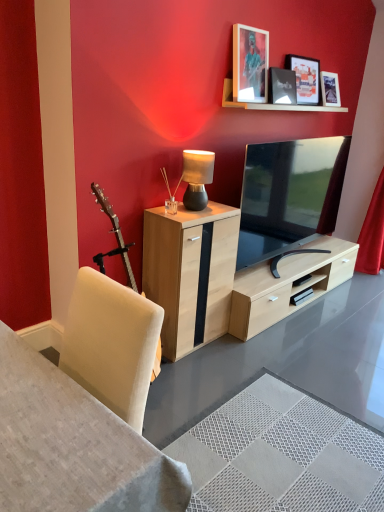
The height and width of the screenshot is (512, 384). What do you see at coordinates (73, 445) in the screenshot? I see `white fabric desk at lower left` at bounding box center [73, 445].

Describe the element at coordinates (305, 78) in the screenshot. The height and width of the screenshot is (512, 384). I see `matte black picture frame at upper center, the third picture frame viewed from the left` at that location.

The width and height of the screenshot is (384, 512). I want to click on matte black tv at center, so click(289, 195).

This screenshot has width=384, height=512. Describe the element at coordinates (289, 195) in the screenshot. I see `matte black tv at center` at that location.

Identify the location of wooden shelf at upper center. Image resolution: width=384 pixels, height=512 pixels. (272, 104).

Based on their positions, is light wood cabinet at center located to the left or right of matte black picture frame at upper center, the third picture frame viewed from the left?

light wood cabinet at center is positioned on matte black picture frame at upper center, the third picture frame viewed from the left,'s left side.

From the image's perspective, between light wood cabinet at center and matte black picture frame at upper center, which is the 1th picture frame from right to left, which one is located above?

matte black picture frame at upper center, which is the 1th picture frame from right to left, appears higher in the image.

Consider the image. Can you tell me how much light wood cabinet at center and matte black picture frame at upper center, which is the 1th picture frame from right to left, differ in facing direction?

The angular difference between light wood cabinet at center and matte black picture frame at upper center, which is the 1th picture frame from right to left, is 1.88 degrees.

Is light wood cabinet at center shorter than matte black picture frame at upper center, which is the 1th picture frame from right to left?

In fact, light wood cabinet at center may be taller than matte black picture frame at upper center, which is the 1th picture frame from right to left.

Which is more to the right, red velvet curtain at right or matte black tv at center?

red velvet curtain at right.

Based on the photo, which is farther, (x=363, y=256) or (x=335, y=152)?

Point (x=363, y=256)

Who is shorter, red velvet curtain at right or matte black tv at center?

Standing shorter between the two is matte black tv at center.

Locate an element on the screen. The height and width of the screenshot is (512, 384). curtain lying on the right of matte black tv at center is located at coordinates (372, 233).

Could you measure the distance between matte black picture frame at upper center, the third picture frame viewed from the left, and matte wooden picture frame at upper center, the 3th picture frame positioned from the right?

The distance of matte black picture frame at upper center, the third picture frame viewed from the left, from matte wooden picture frame at upper center, the 3th picture frame positioned from the right, is 16.55 inches.

There is a matte black picture frame at upper center, which is the 1th picture frame from right to left. Where is `the 1st picture frame below it (from the image's perspective)`? The width and height of the screenshot is (384, 512). the 1st picture frame below it (from the image's perspective) is located at coordinates (250, 64).

Between point (299, 69) and point (259, 46), which one is positioned behind?

Point (299, 69)

Is matte black picture frame at upper center, which is the 1th picture frame from right to left, not inside matte wooden picture frame at upper center, the 3th picture frame positioned from the right?

Indeed, matte black picture frame at upper center, which is the 1th picture frame from right to left, is completely outside matte wooden picture frame at upper center, the 3th picture frame positioned from the right.

Is matte black table lamp at center looking in the opposite direction of red velvet curtain at right?

That's not correct — matte black table lamp at center is not looking away from red velvet curtain at right.

Which object is wider, matte black table lamp at center or red velvet curtain at right?

Wider between the two is red velvet curtain at right.

Is matte black table lamp at center at the left side of red velvet curtain at right?

Yes.

Identify the location of curtain below the matte black table lamp at center (from a real-world perspective). This screenshot has width=384, height=512. (372, 233).

Is matte black tv at center outside of white fabric desk at lower left?

Yes.

Is the depth of matte black tv at center greater than that of white fabric desk at lower left?

Yes.

From a real-world perspective, which is physically below, matte black tv at center or white fabric desk at lower left?

white fabric desk at lower left, from a real-world perspective.

Considering the relative positions of matte black tv at center and white fabric desk at lower left in the image provided, is matte black tv at center to the left or to the right of white fabric desk at lower left?

Based on their positions, matte black tv at center is located to the right of white fabric desk at lower left.

Does matte black picture frame at upper center, which is the 1th picture frame from right to left, appear on the left side of light wood cabinet at center?

Incorrect, matte black picture frame at upper center, which is the 1th picture frame from right to left, is not on the left side of light wood cabinet at center.

How far apart are matte black picture frame at upper center, which is the 1th picture frame from right to left, and light wood cabinet at center?

matte black picture frame at upper center, which is the 1th picture frame from right to left, is 4.88 feet from light wood cabinet at center.

From a real-world perspective, who is located higher, matte black picture frame at upper center, which is the 1th picture frame from right to left, or light wood cabinet at center?

matte black picture frame at upper center, which is the 1th picture frame from right to left, is physically above.

Is matte black picture frame at upper center, which is the 1th picture frame from right to left, in front of or behind light wood cabinet at center in the image?

matte black picture frame at upper center, which is the 1th picture frame from right to left, is behind light wood cabinet at center.

Based on their positions, is matte wooden picture frame at upper center, the 3th picture frame positioned from the right, located to the left or right of matte black tv at center?

matte wooden picture frame at upper center, the 3th picture frame positioned from the right, is positioned on matte black tv at center's left side.

How different are the orientations of matte wooden picture frame at upper center, the 3th picture frame positioned from the right, and matte black tv at center in degrees?

They differ by 0.369 degrees in their facing directions.

Relative to matte black tv at center, is matte wooden picture frame at upper center, placed as the 1th picture frame when sorted from left to right, in front or behind?

matte wooden picture frame at upper center, placed as the 1th picture frame when sorted from left to right, is positioned farther from the viewer than matte black tv at center.

How much distance is there between matte wooden picture frame at upper center, placed as the 1th picture frame when sorted from left to right, and matte black tv at center?

matte wooden picture frame at upper center, placed as the 1th picture frame when sorted from left to right, and matte black tv at center are 25.49 inches apart.

In the image, there is a matte black picture frame at upper center, the third picture frame viewed from the left. Where is `cabinetry below it (from a real-world perspective)`? This screenshot has height=512, width=384. cabinetry below it (from a real-world perspective) is located at coordinates (190, 272).

The image size is (384, 512). Identify the location of curtain behind the matte black tv at center. (372, 233).

Considering their positions, is red velvet curtain at right positioned further to white fabric desk at lower left than wooden shelf at upper center?

Based on the image, red velvet curtain at right appears to be further to white fabric desk at lower left.

Based on their spatial positions, is matte black picture frame at upper center, the second picture frame when ordered from right to left, or white fabric desk at lower left closer to matte black picture frame at upper center, the third picture frame viewed from the left?

matte black picture frame at upper center, the second picture frame when ordered from right to left, is closer to matte black picture frame at upper center, the third picture frame viewed from the left.

When comparing their distances from light wood cabinet at center, does matte black picture frame at upper center, the second picture frame when ordered from right to left, or wooden shelf at upper center seem further?

Among the two, matte black picture frame at upper center, the second picture frame when ordered from right to left, is located further to light wood cabinet at center.

Looking at the image, which one is located further to matte black table lamp at center, white fabric desk at lower left or matte wooden picture frame at upper center, placed as the 1th picture frame when sorted from left to right?

Based on the image, white fabric desk at lower left appears to be further to matte black table lamp at center.

When comparing their distances from matte black table lamp at center, does matte wooden picture frame at upper center, placed as the 1th picture frame when sorted from left to right, or red velvet curtain at right seem closer?

matte wooden picture frame at upper center, placed as the 1th picture frame when sorted from left to right.

Looking at the image, which one is located further to matte black picture frame at upper center, the second picture frame when ordered from right to left, matte black tv at center or white fabric desk at lower left?

white fabric desk at lower left is positioned further to the anchor matte black picture frame at upper center, the second picture frame when ordered from right to left.

Which object lies further to the anchor point light wood cabinet at center, matte black table lamp at center or matte black tv at center?

Based on the image, matte black tv at center appears to be further to light wood cabinet at center.

Considering their positions, is light wood cabinet at center positioned closer to matte black table lamp at center than matte black picture frame at upper center, the second picture frame when ordered from right to left?

Based on the image, light wood cabinet at center appears to be nearer to matte black table lamp at center.

At what (x,y) coordinates should I click in order to perform the action: click on picture frame between wooden shelf at upper center and red velvet curtain at right from left to right. Please return your answer as a coordinate pair (x, y). This screenshot has width=384, height=512. Looking at the image, I should click on (305, 78).

Image resolution: width=384 pixels, height=512 pixels. Identify the location of shelf between white fabric desk at lower left and matte black picture frame at upper center, which is the 1th picture frame from right to left, in the front-back direction. (272, 104).

In order to click on television situated between light wood cabinet at center and red velvet curtain at right from left to right in this screenshot , I will do `click(289, 195)`.

This screenshot has width=384, height=512. I want to click on shelf situated between matte black table lamp at center and matte black tv at center from left to right, so click(272, 104).